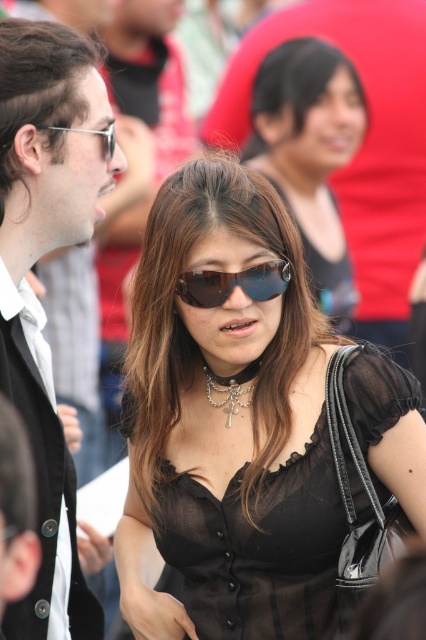
Question: Is matte black jacket at left to the left of sunglasses at center from the viewer's perspective?

Choices:
 (A) yes
 (B) no

Answer: (A)

Question: Does matte black sunglasses at upper left come in front of sunglasses at center?

Choices:
 (A) no
 (B) yes

Answer: (B)

Question: Which point is closer to the camera taking this photo?

Choices:
 (A) (256, 269)
 (B) (333, 264)

Answer: (A)

Question: Which point is closer to the camera?

Choices:
 (A) silver metallic necklace at center
 (B) black sheer dress at center

Answer: (A)

Question: Is satin black blouse at center above matte black sunglasses at upper left?

Choices:
 (A) no
 (B) yes

Answer: (B)

Question: Which point is closer to the camera?

Choices:
 (A) satin black blouse at center
 (B) matte black jacket at left
 (C) sunglasses at center
 (D) silver metallic necklace at center

Answer: (B)